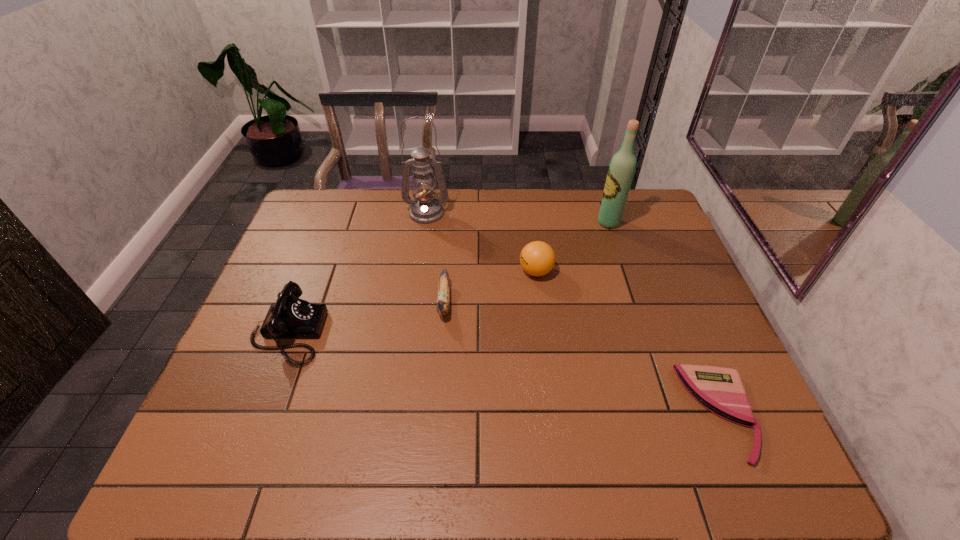
At what (x,y) coordinates should I click in order to perform the action: click on the fourth closest object relative to the banana. Please return your answer as a coordinate pair (x, y). The height and width of the screenshot is (540, 960). Looking at the image, I should click on (621, 170).

Locate an element on the screen. The height and width of the screenshot is (540, 960). free space that satisfies the following two spatial constraints: 1. on the front-facing side of the wine bottle; 2. at the stem of the banana is located at coordinates (635, 301).

Where is `vacant area that satisfies the following two spatial constraints: 1. on the back side of the wristlet; 2. on the side with brand of the fourth object from left to right`? This screenshot has width=960, height=540. vacant area that satisfies the following two spatial constraints: 1. on the back side of the wristlet; 2. on the side with brand of the fourth object from left to right is located at coordinates (661, 272).

Find the location of `vacant area in the image that satisfies the following two spatial constraints: 1. on the front-facing side of the wine bottle; 2. at the stem of the banana`. vacant area in the image that satisfies the following two spatial constraints: 1. on the front-facing side of the wine bottle; 2. at the stem of the banana is located at coordinates (635, 301).

This screenshot has height=540, width=960. Identify the location of vacant area that satisfies the following two spatial constraints: 1. at the stem of the banana; 2. on the left side of the wristlet. (436, 413).

This screenshot has height=540, width=960. Find the location of `free spot that satisfies the following two spatial constraints: 1. on the side with brand of the third object from right to left; 2. on the left side of the wristlet`. free spot that satisfies the following two spatial constraints: 1. on the side with brand of the third object from right to left; 2. on the left side of the wristlet is located at coordinates (554, 413).

The image size is (960, 540). I want to click on vacant point that satisfies the following two spatial constraints: 1. on the dial of the leftmost object; 2. on the right side of the shortest object, so click(257, 413).

The width and height of the screenshot is (960, 540). What are the coordinates of `vacant space that satisfies the following two spatial constraints: 1. at the stem of the wristlet; 2. on the right side of the banana` in the screenshot? It's located at (436, 413).

Where is `vacant region that satisfies the following two spatial constraints: 1. on the front side of the oil lamp; 2. on the dial of the telephone`? vacant region that satisfies the following two spatial constraints: 1. on the front side of the oil lamp; 2. on the dial of the telephone is located at coordinates (410, 333).

Image resolution: width=960 pixels, height=540 pixels. Find the location of `free space in the image that satisfies the following two spatial constraints: 1. on the front-facing side of the wine bottle; 2. at the stem of the banana`. free space in the image that satisfies the following two spatial constraints: 1. on the front-facing side of the wine bottle; 2. at the stem of the banana is located at coordinates (635, 301).